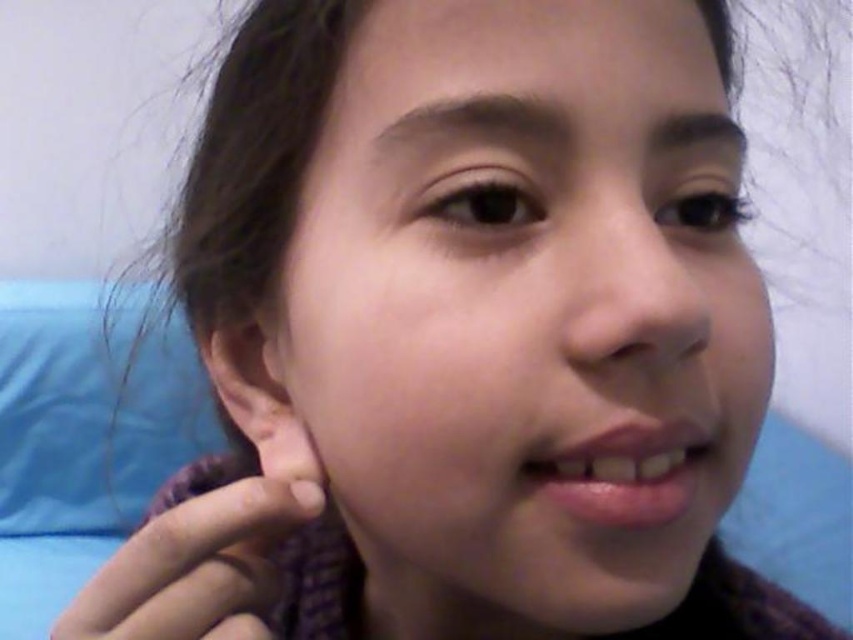
Question: Which object appears closest to the camera in this image?

Choices:
 (A) smooth skin face at center
 (B) smooth skin ear at lower left
 (C) blue fabric pillow at lower left
 (D) purple knitted hand at lower left

Answer: (A)

Question: Does blue fabric pillow at lower left have a greater width compared to purple knitted hand at lower left?

Choices:
 (A) no
 (B) yes

Answer: (B)

Question: Does purple knitted hand at lower left have a greater width compared to smooth skin ear at lower left?

Choices:
 (A) yes
 (B) no

Answer: (A)

Question: Estimate the real-world distances between objects in this image. Which object is closer to the purple knitted hand at lower left?

Choices:
 (A) blue fabric pillow at lower left
 (B) smooth skin face at center
 (C) smooth skin ear at lower left

Answer: (C)

Question: Which is nearer to the smooth skin face at center?

Choices:
 (A) smooth skin ear at lower left
 (B) purple knitted hand at lower left
 (C) blue fabric pillow at lower left

Answer: (B)

Question: Can you confirm if smooth skin face at center is wider than blue fabric pillow at lower left?

Choices:
 (A) yes
 (B) no

Answer: (B)